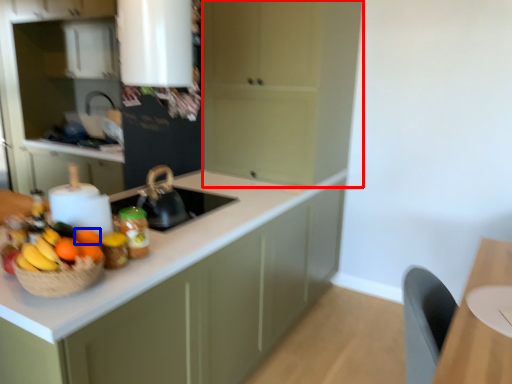
Question: Among these objects, which one is nearest to the camera, cabinetry (highlighted by a red box) or orange (highlighted by a blue box)?

Choices:
 (A) cabinetry
 (B) orange

Answer: (B)